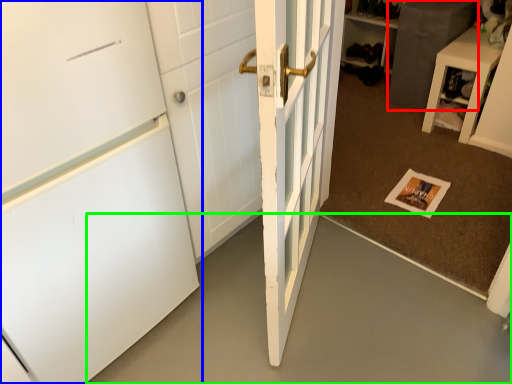
Question: Estimate the real-world distances between objects in this image. Which object is closer to cabinetry (highlighted by a red box), door (highlighted by a blue box) or concrete (highlighted by a green box)?

Choices:
 (A) door
 (B) concrete

Answer: (B)